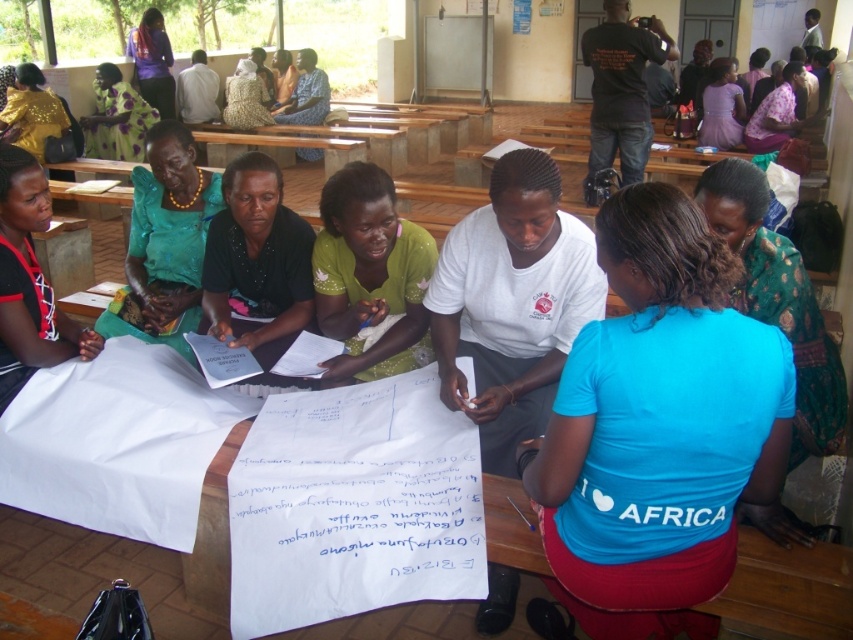
Between point (401, 326) and point (163, 77), which one is positioned behind?

The point (163, 77) is more distant.

From the picture: Who is more forward, (390, 227) or (154, 13)?

Positioned in front is point (390, 227).

This screenshot has height=640, width=853. I want to click on green fabric shirt at center, so click(369, 273).

Does blue t-shirt at center have a lesser width compared to green fabric shirt at center?

No, blue t-shirt at center is not thinner than green fabric shirt at center.

Does blue t-shirt at center appear on the left side of green fabric shirt at center?

Incorrect, blue t-shirt at center is not on the left side of green fabric shirt at center.

The width and height of the screenshot is (853, 640). Find the location of `blue t-shirt at center`. blue t-shirt at center is located at coordinates (659, 428).

Which of these two, black cotton shirt at upper right or green fabric dress at upper center, stands shorter?

Standing shorter between the two is green fabric dress at upper center.

Does black cotton shirt at upper right come in front of green fabric dress at upper center?

Yes, it is in front of green fabric dress at upper center.

Who is more forward, (637,36) or (251,108)?

Point (637,36)

Image resolution: width=853 pixels, height=640 pixels. I want to click on black cotton shirt at upper right, so click(x=621, y=90).